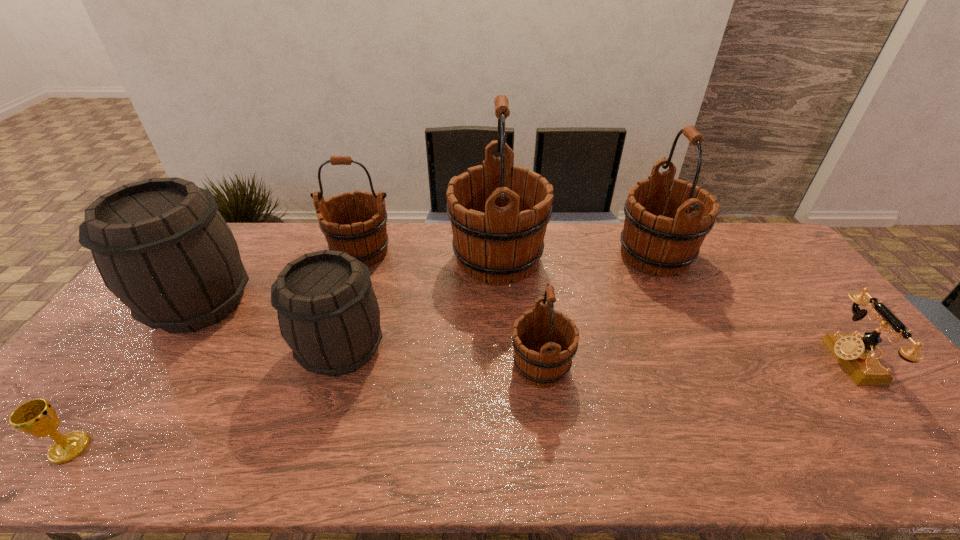
You are a GUI agent. You are given a task and a screenshot of the screen. Output one action in this format:
    pyautogui.click(x=<x>, y=<y>)
    Task: Click on the vacant point located 0.370m on the dial of the rightmost object
    The height and width of the screenshot is (540, 960).
    Given the screenshot: What is the action you would take?
    692,360

What are the coordinates of `vacant position located on the dial of the rightmost object` in the screenshot? It's located at (722, 360).

Image resolution: width=960 pixels, height=540 pixels. I want to click on vacant point located on the back of the gold chalice, so click(x=128, y=369).

Find the location of `object situated at the near edge`. object situated at the near edge is located at coordinates (38, 418).

At what (x,y) coordinates should I click in order to perform the action: click on wine bucket present at the left edge. Please return your answer as a coordinate pair (x, y). Looking at the image, I should click on (161, 246).

The height and width of the screenshot is (540, 960). In order to click on chalice at the left edge in this screenshot , I will do `click(38, 418)`.

Where is `object located at the right edge`? This screenshot has height=540, width=960. object located at the right edge is located at coordinates (856, 355).

Identify the location of object at the near left corner. The width and height of the screenshot is (960, 540). (38, 418).

You are a GUI agent. You are given a task and a screenshot of the screen. Output one action in this format:
    pyautogui.click(x=<x>, y=<y>)
    Task: Click on the free space at the far edge of the desktop
    The height and width of the screenshot is (540, 960).
    Given the screenshot: What is the action you would take?
    pyautogui.click(x=553, y=230)

The width and height of the screenshot is (960, 540). In the image, there is a desktop. What are the coordinates of `vacant space at the near edge` in the screenshot? It's located at (668, 438).